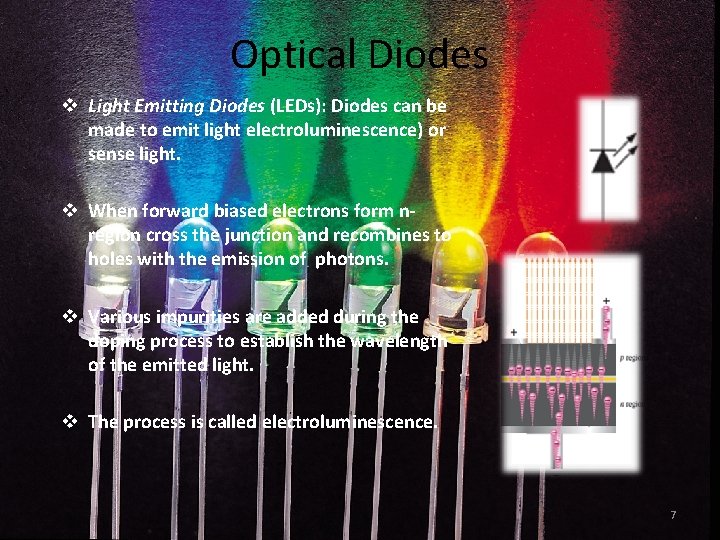
Where is `green light`? green light is located at coordinates (374, 160).